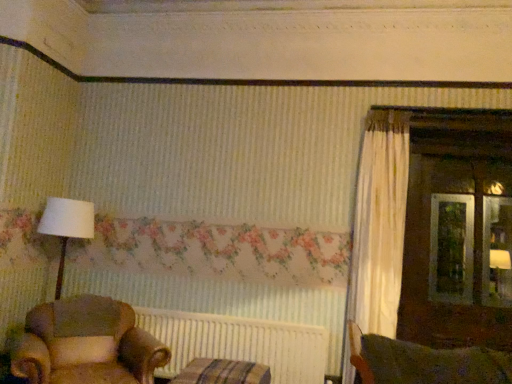
Question: Is leather armchair at lower left aimed at white ribbed radiator at center?

Choices:
 (A) yes
 (B) no

Answer: (B)

Question: Does leather armchair at lower left have a greater width compared to white ribbed radiator at center?

Choices:
 (A) yes
 (B) no

Answer: (A)

Question: Considering the relative positions of leather armchair at lower left and white ribbed radiator at center in the image provided, is leather armchair at lower left to the left of white ribbed radiator at center from the viewer's perspective?

Choices:
 (A) no
 (B) yes

Answer: (B)

Question: Is leather armchair at lower left positioned behind white ribbed radiator at center?

Choices:
 (A) yes
 (B) no

Answer: (B)

Question: Is leather armchair at lower left at the right side of white ribbed radiator at center?

Choices:
 (A) no
 (B) yes

Answer: (A)

Question: In terms of size, does striped fabric cushion at lower center appear bigger or smaller than white ribbed radiator at center?

Choices:
 (A) big
 (B) small

Answer: (A)

Question: Visually, is striped fabric cushion at lower center positioned to the left or to the right of white ribbed radiator at center?

Choices:
 (A) right
 (B) left

Answer: (A)

Question: From the image's perspective, is striped fabric cushion at lower center located above or below white ribbed radiator at center?

Choices:
 (A) above
 (B) below

Answer: (B)

Question: Choose the correct answer: Is striped fabric cushion at lower center inside white ribbed radiator at center or outside it?

Choices:
 (A) outside
 (B) inside

Answer: (A)

Question: From a real-world perspective, is leather armchair at lower left physically located above or below striped fabric cushion at lower center?

Choices:
 (A) above
 (B) below

Answer: (A)

Question: In the image, is leather armchair at lower left on the left side or the right side of striped fabric cushion at lower center?

Choices:
 (A) right
 (B) left

Answer: (B)

Question: In terms of width, does leather armchair at lower left look wider or thinner when compared to striped fabric cushion at lower center?

Choices:
 (A) thin
 (B) wide

Answer: (B)

Question: Is leather armchair at lower left bigger or smaller than striped fabric cushion at lower center?

Choices:
 (A) big
 (B) small

Answer: (A)

Question: Does point (208, 349) appear closer or farther from the camera than point (243, 382)?

Choices:
 (A) farther
 (B) closer

Answer: (A)

Question: In terms of width, does white ribbed radiator at center look wider or thinner when compared to striped fabric cushion at lower center?

Choices:
 (A) wide
 (B) thin

Answer: (B)